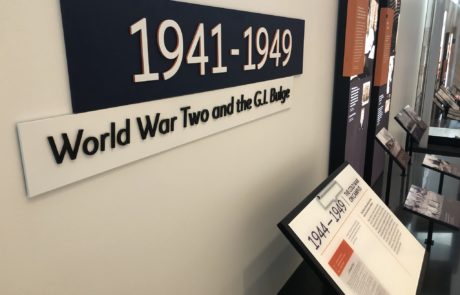
Where is `grey floor, lower right side`? Image resolution: width=460 pixels, height=295 pixels. grey floor, lower right side is located at coordinates (441, 244), (452, 188), (433, 180), (452, 162).